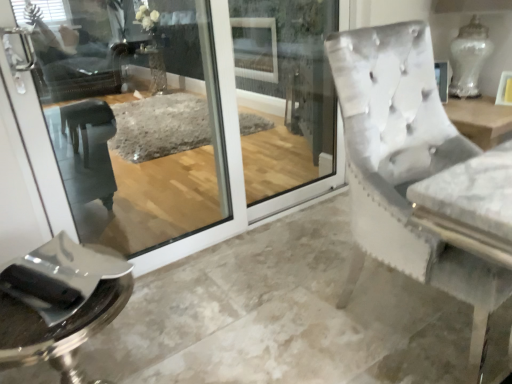
Identify the location of vacant space underneath clear glass screen door at center (from a real-world perspective). The width and height of the screenshot is (512, 384). (254, 225).